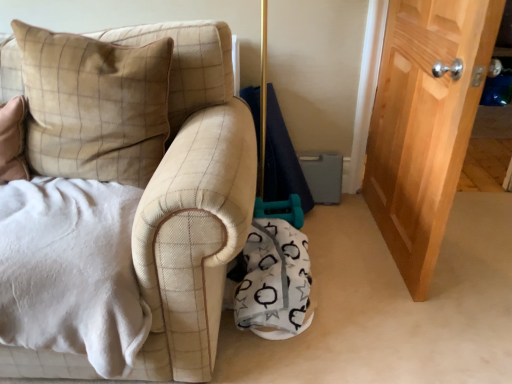
Question: Can you confirm if white fabric blanket at lower center is shorter than wooden door at right?

Choices:
 (A) yes
 (B) no

Answer: (A)

Question: Considering the relative sizes of white fabric blanket at lower center and wooden door at right in the image provided, is white fabric blanket at lower center thinner than wooden door at right?

Choices:
 (A) no
 (B) yes

Answer: (A)

Question: Considering the relative sizes of white fabric blanket at lower center and wooden door at right in the image provided, is white fabric blanket at lower center bigger than wooden door at right?

Choices:
 (A) no
 (B) yes

Answer: (A)

Question: Does white fabric blanket at lower center touch wooden door at right?

Choices:
 (A) yes
 (B) no

Answer: (B)

Question: From a real-world perspective, is white fabric blanket at lower center physically below wooden door at right?

Choices:
 (A) no
 (B) yes

Answer: (B)

Question: Visually, is white fabric blanket at lower center positioned to the left or to the right of beige velvety pillow at left?

Choices:
 (A) left
 (B) right

Answer: (B)

Question: From the image's perspective, is white fabric blanket at lower center above or below beige velvety pillow at left?

Choices:
 (A) above
 (B) below

Answer: (B)

Question: From a real-world perspective, relative to beige velvety pillow at left, is white fabric blanket at lower center vertically above or below?

Choices:
 (A) above
 (B) below

Answer: (B)

Question: Would you say white fabric blanket at lower center is inside or outside beige velvety pillow at left?

Choices:
 (A) inside
 (B) outside

Answer: (B)

Question: In terms of size, does beige velvety pillow at left appear bigger or smaller than wooden door at right?

Choices:
 (A) big
 (B) small

Answer: (B)

Question: Considering the positions of beige velvety pillow at left and wooden door at right in the image, is beige velvety pillow at left wider or thinner than wooden door at right?

Choices:
 (A) wide
 (B) thin

Answer: (A)

Question: Relative to wooden door at right, is beige velvety pillow at left in front or behind?

Choices:
 (A) front
 (B) behind

Answer: (A)

Question: Choose the correct answer: Is beige velvety pillow at left inside wooden door at right or outside it?

Choices:
 (A) inside
 (B) outside

Answer: (B)

Question: From the image's perspective, is wooden door at right above or below white fabric blanket at lower center?

Choices:
 (A) below
 (B) above

Answer: (B)

Question: Considering their positions, is wooden door at right located in front of or behind white fabric blanket at lower center?

Choices:
 (A) behind
 (B) front

Answer: (A)